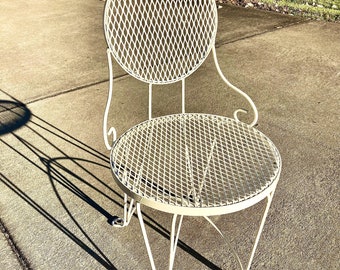
Identify the location of metal leg of chair. (144, 235).